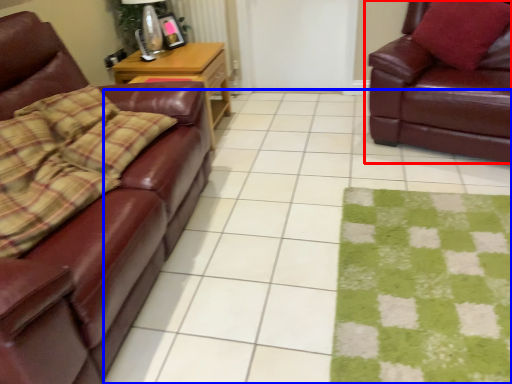
Question: Which object is further to the camera taking this photo, studio couch (highlighted by a red box) or square (highlighted by a blue box)?

Choices:
 (A) studio couch
 (B) square

Answer: (A)